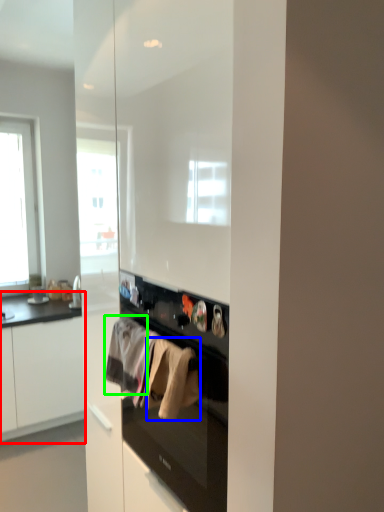
Question: Estimate the real-world distances between objects in this image. Which object is closer to cabinetry (highlighted by a red box), clothing (highlighted by a blue box) or clothing (highlighted by a green box)?

Choices:
 (A) clothing
 (B) clothing

Answer: (B)